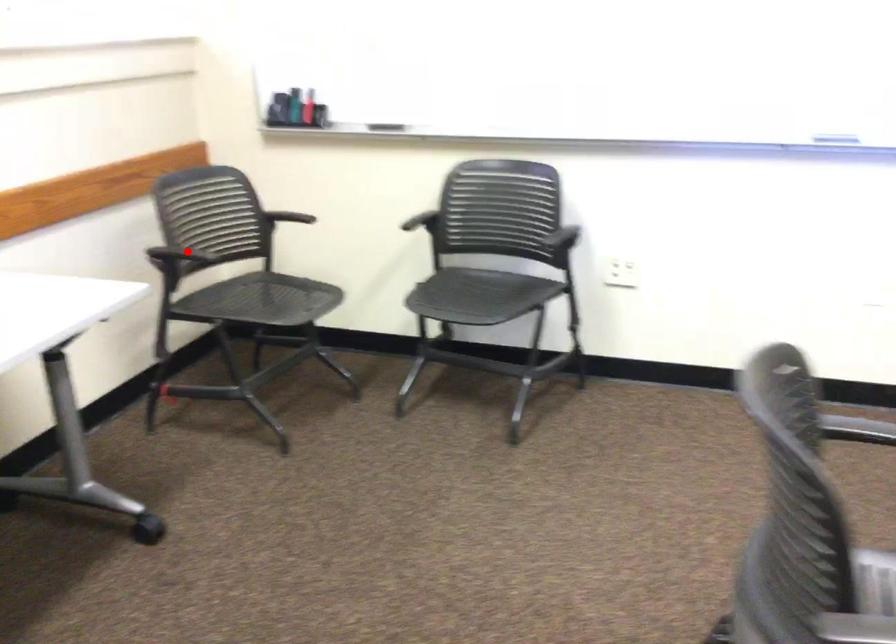
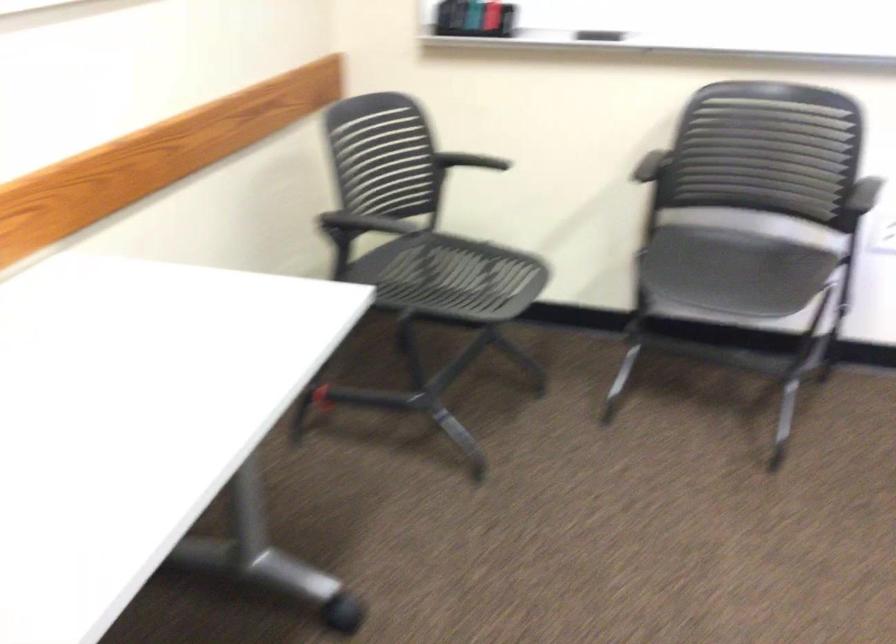
Question: I am providing you with two images of the same scene from different viewpoints. A red point is shown in image1. For the corresponding object point in image2, is it positioned nearer or farther from the camera?

Choices:
 (A) Nearer
 (B) Farther

Answer: (A)